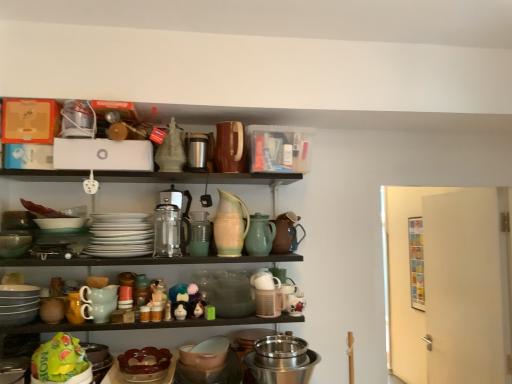
Question: In which direction should I rotate to look at matte white figurine at center, which is the second toy from right to left?

Choices:
 (A) right
 (B) left

Answer: (B)

Question: Is white glossy plates at center, arranged as the third tableware when viewed from the left, inside matte ceramic pitcher at center, which appears as the second tableware when viewed from the right?

Choices:
 (A) no
 (B) yes

Answer: (A)

Question: Is matte ceramic pitcher at center, which appears as the second tableware when viewed from the right, shorter than white glossy plates at center, the fifth tableware in the right-to-left sequence?

Choices:
 (A) yes
 (B) no

Answer: (A)

Question: Can you confirm if matte ceramic pitcher at center, the sixth tableware when ordered from left to right, is taller than white glossy plates at center, the fifth tableware in the right-to-left sequence?

Choices:
 (A) no
 (B) yes

Answer: (A)

Question: Is matte ceramic pitcher at center, the sixth tableware when ordered from left to right, not near white glossy plates at center, the fifth tableware in the right-to-left sequence?

Choices:
 (A) yes
 (B) no

Answer: (B)

Question: Can you confirm if matte ceramic pitcher at center, the sixth tableware when ordered from left to right, is smaller than white glossy plates at center, arranged as the third tableware when viewed from the left?

Choices:
 (A) no
 (B) yes

Answer: (B)

Question: Is matte ceramic pitcher at center, the sixth tableware when ordered from left to right, behind white glossy plates at center, arranged as the third tableware when viewed from the left?

Choices:
 (A) no
 (B) yes

Answer: (B)

Question: Considering the relative sizes of stainless steel bowl at lower center, the 3th appliance viewed from the left, and matte plastic toy at center, acting as the 1th toy starting from the left, in the image provided, is stainless steel bowl at lower center, the 3th appliance viewed from the left, wider than matte plastic toy at center, acting as the 1th toy starting from the left,?

Choices:
 (A) yes
 (B) no

Answer: (A)

Question: Is stainless steel bowl at lower center, which ranks as the 1th appliance in bottom-to-top order, placed right next to matte plastic toy at center, acting as the 1th toy starting from the left?

Choices:
 (A) no
 (B) yes

Answer: (A)

Question: Can you confirm if stainless steel bowl at lower center, which ranks as the 1th appliance in bottom-to-top order, is smaller than matte plastic toy at center, acting as the 1th toy starting from the left?

Choices:
 (A) no
 (B) yes

Answer: (A)

Question: Is stainless steel bowl at lower center, which ranks as the 1th appliance in bottom-to-top order, behind matte plastic toy at center, which appears as the 3th toy when viewed from the right?

Choices:
 (A) yes
 (B) no

Answer: (B)

Question: From a real-world perspective, is stainless steel bowl at lower center, the 3th appliance viewed from the left, physically above matte plastic toy at center, which appears as the 3th toy when viewed from the right?

Choices:
 (A) yes
 (B) no

Answer: (B)

Question: Is stainless steel bowl at lower center, which ranks as the 1th appliance in bottom-to-top order, outside of matte plastic toy at center, which appears as the 3th toy when viewed from the right?

Choices:
 (A) no
 (B) yes

Answer: (B)

Question: Is matte white figurine at center, which is the second toy from right to left, turned away from brown glossy cake stand at lower center, which appears as the fourth tableware when viewed from the left?

Choices:
 (A) yes
 (B) no

Answer: (B)